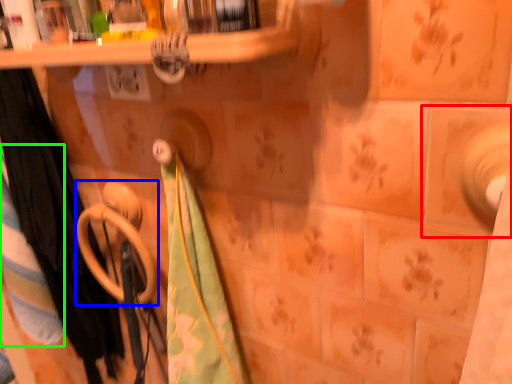
Question: Based on their relative distances, which object is nearer to ceramic tile (highlighted by a red box)? Choose from towel rack (highlighted by a blue box) and beach towel (highlighted by a green box).

Choices:
 (A) towel rack
 (B) beach towel

Answer: (A)